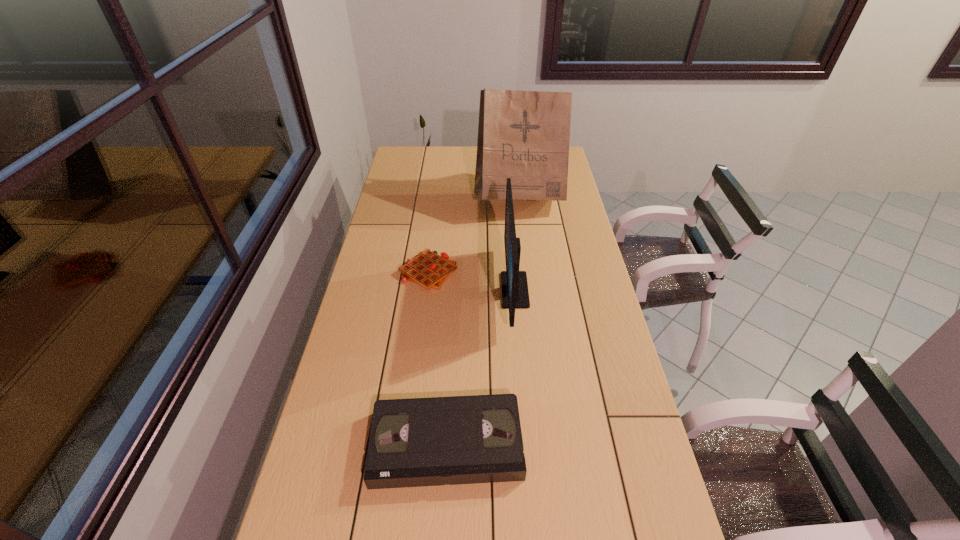
The width and height of the screenshot is (960, 540). Identify the location of free space located 0.400m on the front of the shortest object. (414, 391).

Locate an element on the screen. videotape that is at the left edge is located at coordinates (415, 442).

What are the coordinates of `waffle at the left edge` in the screenshot? It's located at (428, 269).

Identify the location of object positioned at the right edge. This screenshot has height=540, width=960. (524, 135).

Image resolution: width=960 pixels, height=540 pixels. In the image, there is a desktop. What are the coordinates of `vacant space at the far edge` in the screenshot? It's located at (428, 158).

In the image, there is a desktop. Identify the location of free space at the left edge. (413, 174).

The image size is (960, 540). Find the location of `vacant area at the right edge of the desktop`. vacant area at the right edge of the desktop is located at coordinates (x=576, y=192).

The width and height of the screenshot is (960, 540). I want to click on blank region between the shortest object and the nearest object, so [x=438, y=358].

You are a GUI agent. You are given a task and a screenshot of the screen. Output one action in this format:
    pyautogui.click(x=<x>, y=<y>)
    Task: Click on the free area in between the computer monitor and the nearest object
    This screenshot has width=960, height=540.
    Given the screenshot: What is the action you would take?
    pyautogui.click(x=481, y=367)

The height and width of the screenshot is (540, 960). In order to click on vacant region between the second tallest object and the waffle in this screenshot , I will do coord(471,281).